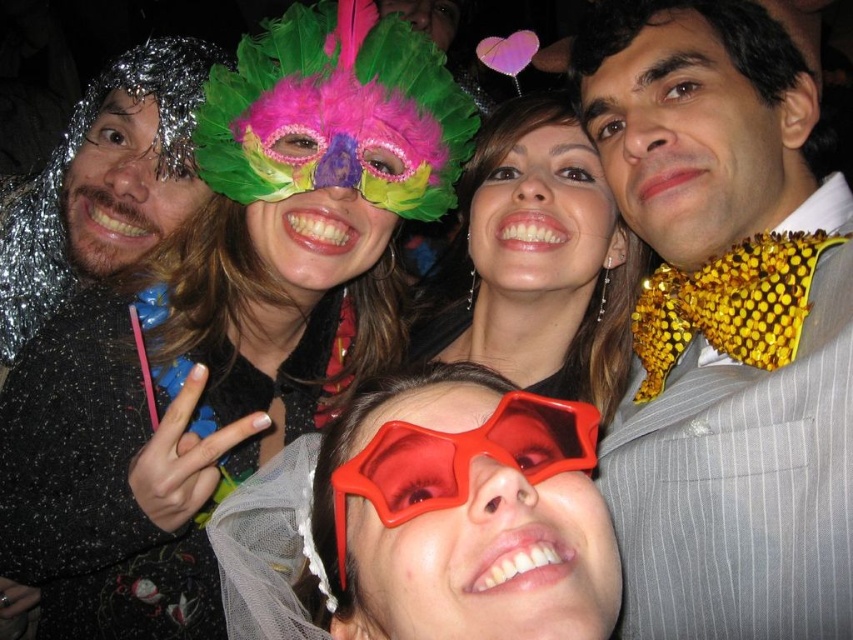
Question: Estimate the real-world distances between objects in this image. Which object is farther from the shiny gold bow tie at center?

Choices:
 (A) matte black dress at center
 (B) red plastic goggles at center
 (C) feathered mask at upper center

Answer: (C)

Question: Can you confirm if black sequined dress at upper left is positioned to the right of shiny metallic foil at left?

Choices:
 (A) no
 (B) yes

Answer: (B)

Question: Can you confirm if matte black dress at center is smaller than shiny metallic foil at left?

Choices:
 (A) yes
 (B) no

Answer: (A)

Question: Which object is positioned closest to the shiny gold bow tie at center?

Choices:
 (A) shiny metallic foil at left
 (B) transparent plastic glasses at center

Answer: (B)

Question: Is feathered mask at upper center to the left of matte black dress at center from the viewer's perspective?

Choices:
 (A) no
 (B) yes

Answer: (B)

Question: Which point appears farthest from the camera in this image?

Choices:
 (A) (643, 440)
 (B) (247, 237)

Answer: (B)